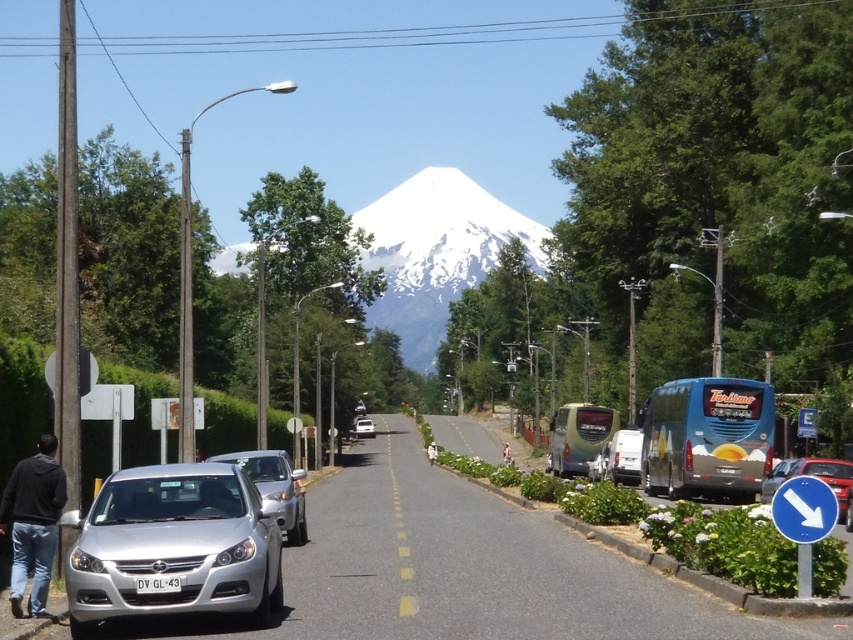
Question: Can you confirm if silver metallic car at lower left is positioned to the right of metallic red car at center?

Choices:
 (A) no
 (B) yes

Answer: (A)

Question: Is silver metallic car at lower left further to the viewer compared to white snow-covered mountain at center?

Choices:
 (A) no
 (B) yes

Answer: (A)

Question: Can you confirm if metallic red car at center is wider than white matte car at center?

Choices:
 (A) no
 (B) yes

Answer: (B)

Question: Which of these objects is positioned farthest from the metallic red car at center?

Choices:
 (A) white snow-covered mountain at center
 (B) white matte van at center
 (C) white matte car at center

Answer: (A)

Question: Which point appears closest to the camera in this image?

Choices:
 (A) (357, 419)
 (B) (434, 353)
 (C) (242, 461)
 (D) (238, 509)

Answer: (D)

Question: Based on their relative distances, which object is nearer to the white matte car at center?

Choices:
 (A) black hoodie at lower left
 (B) white snow-covered mountain at center

Answer: (A)